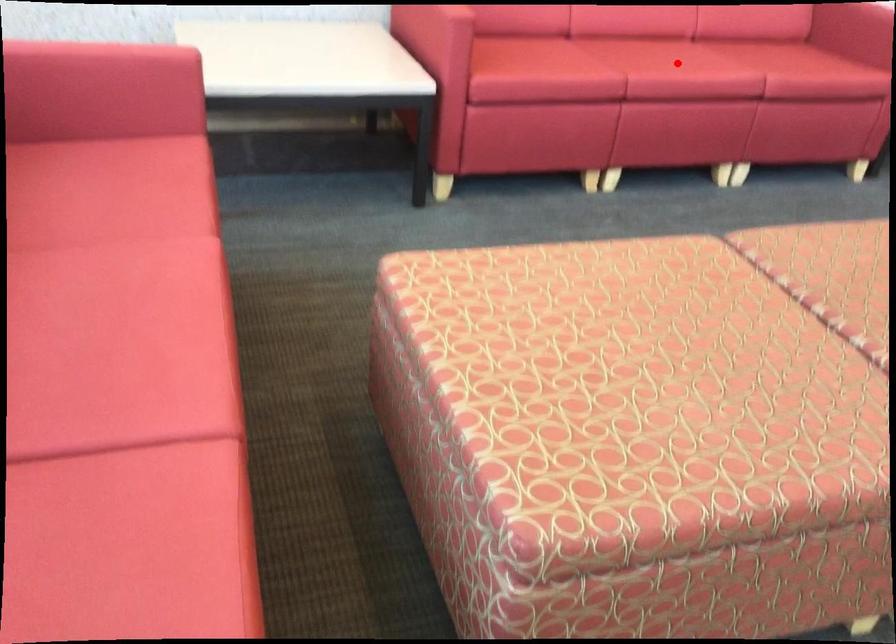
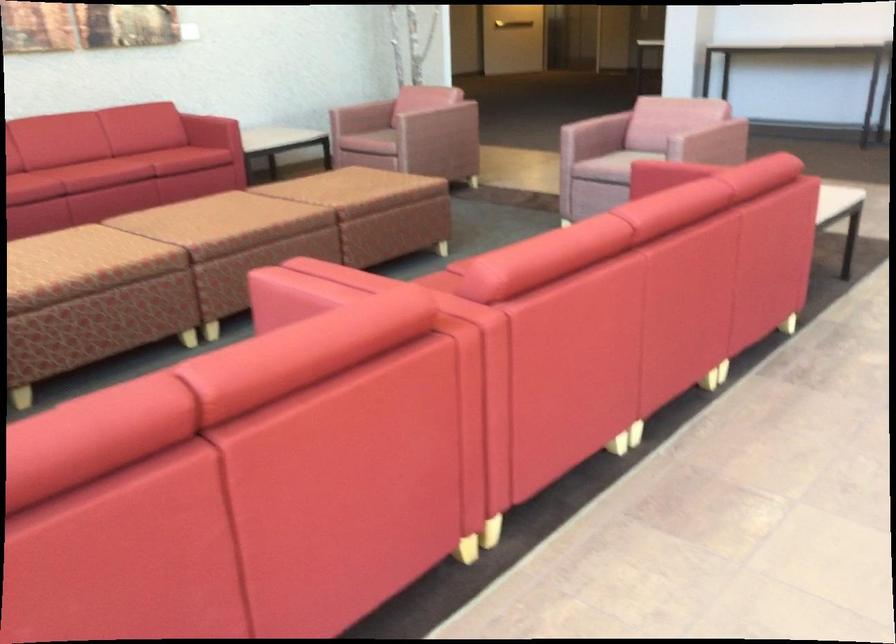
Where in the second image is the point corresponding to the highlighted location from the first image?

(99, 165)